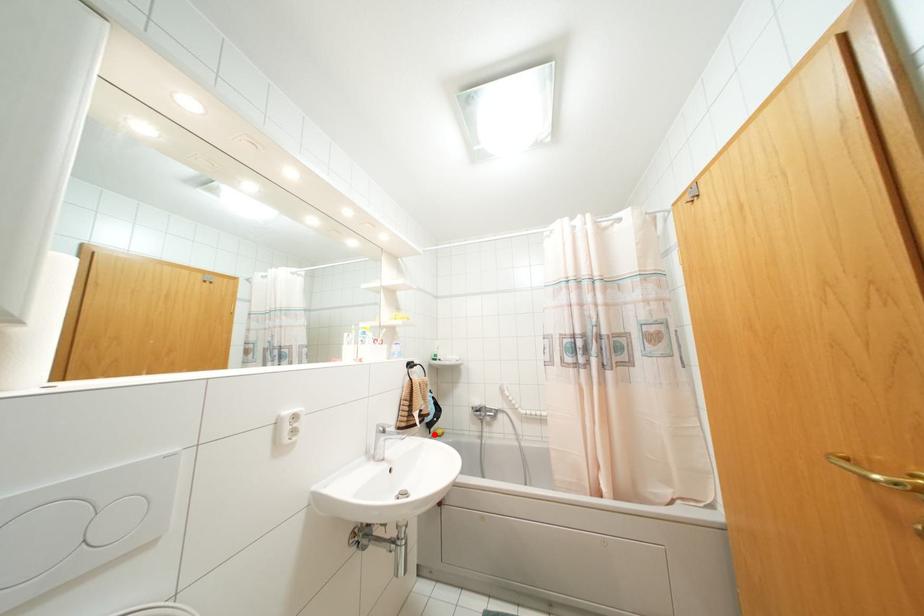
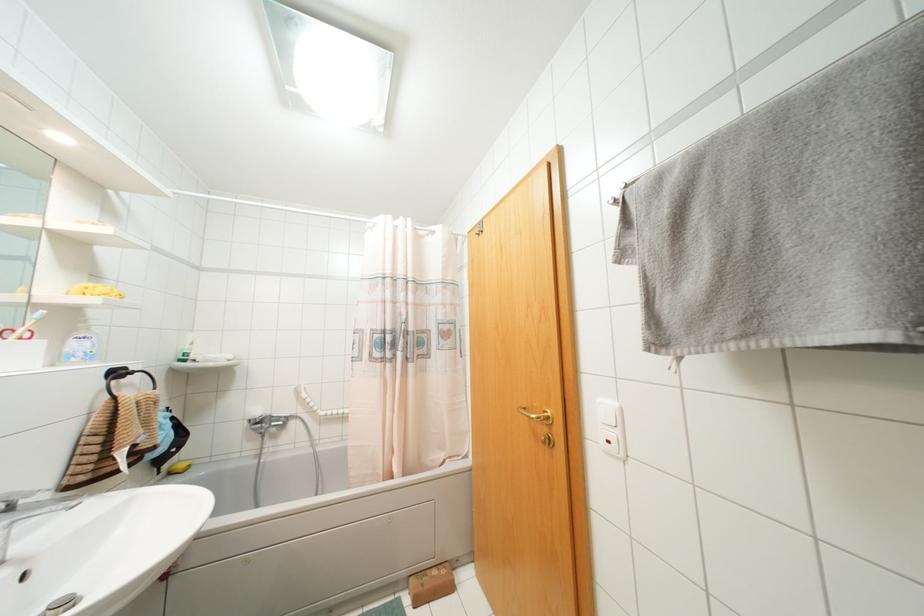
Question: I am providing you with two images of the same scene from different viewpoints. A red point is shown in image1. For the corresponding object point in image2, is it positioned nearer or farther from the camera?

Choices:
 (A) Nearer
 (B) Farther

Answer: (A)